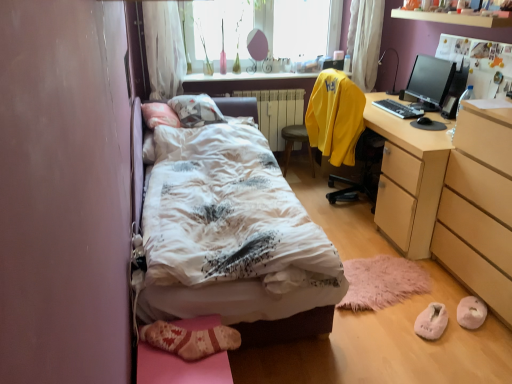
You are a GUI agent. You are given a task and a screenshot of the screen. Output one action in this format:
    pyautogui.click(x=<x>, y=<y>)
    Task: Click on the vacant area on top of pink fuzzy slippers at lower right, placed as the 2th shoe when sorted from right to left (from a real-world perspective)
    The image size is (512, 384).
    Given the screenshot: What is the action you would take?
    pyautogui.click(x=434, y=312)